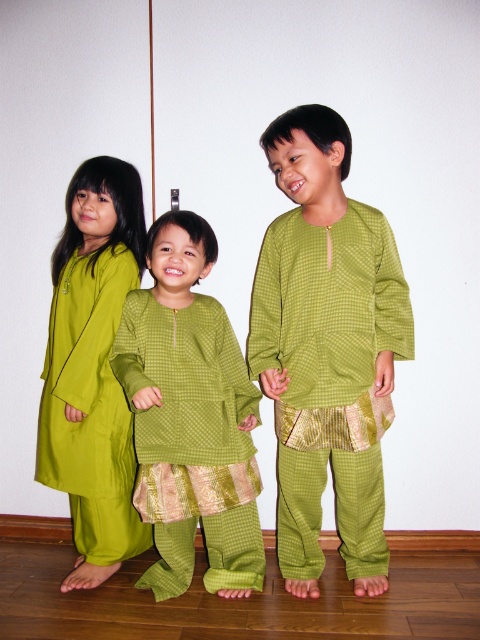
You are a photographer adjusting your camera to focus on two specific points in the image. The first point is at coordinates point (382, 225) and the second is at point (180, 250). Which point should you focus on first if you want to capture the closest object to the camera?

Point (382, 225) is closer to the camera than point (180, 250), so you should focus on point (382, 225) first to capture the closest object.

You are a photographer setting up a photo shoot for two children wearing the green textured kurta at center and the matte green dress at left. You want to ensure both outfits are visible in the frame. Given their sizes, which child should you position closer to the camera to avoid cropping either outfit?

The green textured kurta at center is wider than the matte green dress at left, so you should position the child wearing the green textured kurta at center closer to the camera to ensure both outfits fit within the frame without cropping.